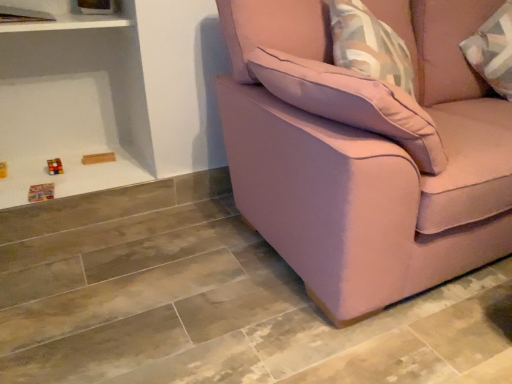
Question: Is pink fabric pillow at upper right to the left of pink fabric couch at right from the viewer's perspective?

Choices:
 (A) no
 (B) yes

Answer: (B)

Question: Can you confirm if pink fabric pillow at upper right is wider than pink fabric couch at right?

Choices:
 (A) no
 (B) yes

Answer: (A)

Question: Is pink fabric pillow at upper right completely or partially outside of pink fabric couch at right?

Choices:
 (A) yes
 (B) no

Answer: (B)

Question: Considering the relative positions of pink fabric pillow at upper right and pink fabric couch at right in the image provided, is pink fabric pillow at upper right to the right of pink fabric couch at right from the viewer's perspective?

Choices:
 (A) yes
 (B) no

Answer: (B)

Question: Considering the relative sizes of pink fabric pillow at upper right and pink fabric couch at right in the image provided, is pink fabric pillow at upper right thinner than pink fabric couch at right?

Choices:
 (A) yes
 (B) no

Answer: (A)

Question: Considering the relative positions of pink fabric pillow at upper right and white glossy shelf at upper left in the image provided, is pink fabric pillow at upper right to the left or to the right of white glossy shelf at upper left?

Choices:
 (A) right
 (B) left

Answer: (A)

Question: Considering the positions of point (328, 110) and point (97, 23), is point (328, 110) closer or farther from the camera than point (97, 23)?

Choices:
 (A) farther
 (B) closer

Answer: (B)

Question: From a real-world perspective, is pink fabric pillow at upper right above or below white glossy shelf at upper left?

Choices:
 (A) below
 (B) above

Answer: (A)

Question: Considering the positions of pink fabric pillow at upper right and white glossy shelf at upper left in the image, is pink fabric pillow at upper right wider or thinner than white glossy shelf at upper left?

Choices:
 (A) wide
 (B) thin

Answer: (A)

Question: Is pink fabric couch at right in front of or behind white glossy shelf at upper left in the image?

Choices:
 (A) front
 (B) behind

Answer: (A)

Question: Is pink fabric couch at right to the left or to the right of white glossy shelf at upper left in the image?

Choices:
 (A) left
 (B) right

Answer: (B)

Question: Is pink fabric couch at right inside the boundaries of white glossy shelf at upper left, or outside?

Choices:
 (A) outside
 (B) inside

Answer: (A)

Question: Looking at their shapes, would you say pink fabric couch at right is wider or thinner than white glossy shelf at upper left?

Choices:
 (A) wide
 (B) thin

Answer: (A)

Question: Is point (498, 134) closer or farther from the camera than point (390, 112)?

Choices:
 (A) farther
 (B) closer

Answer: (A)

Question: Would you say pink fabric couch at right is inside or outside pink fabric pillow at upper right?

Choices:
 (A) outside
 (B) inside

Answer: (A)